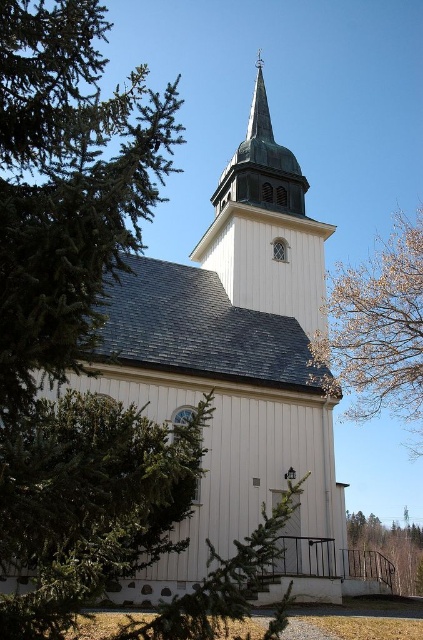
From the picture: You are standing in front of the church and want to compare the widths of the white wooden steeple at upper center and the green leafy tree at lower right. Which one is wider?

The green leafy tree at lower right is wider than the white wooden steeple at upper center.

You are standing in front of the church and want to take a photo that includes both the white wooden steeple at upper center and the green leafy tree at lower right. Which object will appear bigger in the photo?

The white wooden steeple at upper center will appear bigger in the photo because it has a larger size compared to the green leafy tree at lower right.